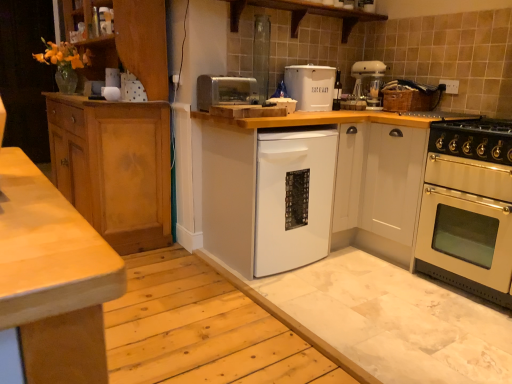
Image resolution: width=512 pixels, height=384 pixels. Identify the location of free space in front of white matte dishwasher at center. (287, 303).